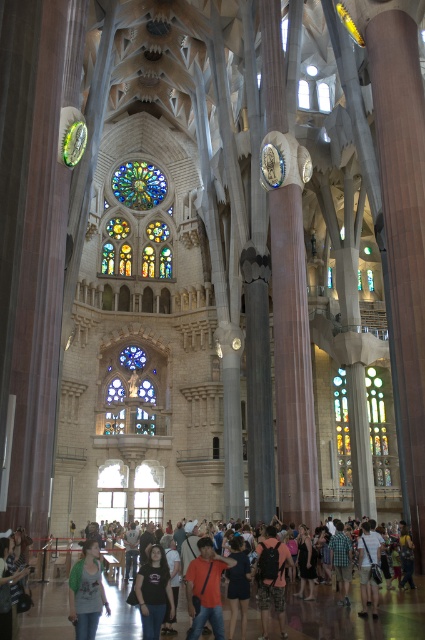
You are a visitor in the cathedral and want to place your dark brown backpack at center on top of the denim jeans at lower left. Is this possible based on their sizes?

The dark brown backpack at center has a greater height compared to denim jeans at lower left. Therefore, placing the dark brown backpack at center on top of the denim jeans at lower left may not be feasible due to the backpack being taller.

You are standing in the cathedral and notice two stained glass artworks. One is labeled as the stained glass window at center and the other as stained glass at center. According to their positions, which one is positioned more to the left?

The stained glass window at center is positioned more to the left compared to the stained glass at center.